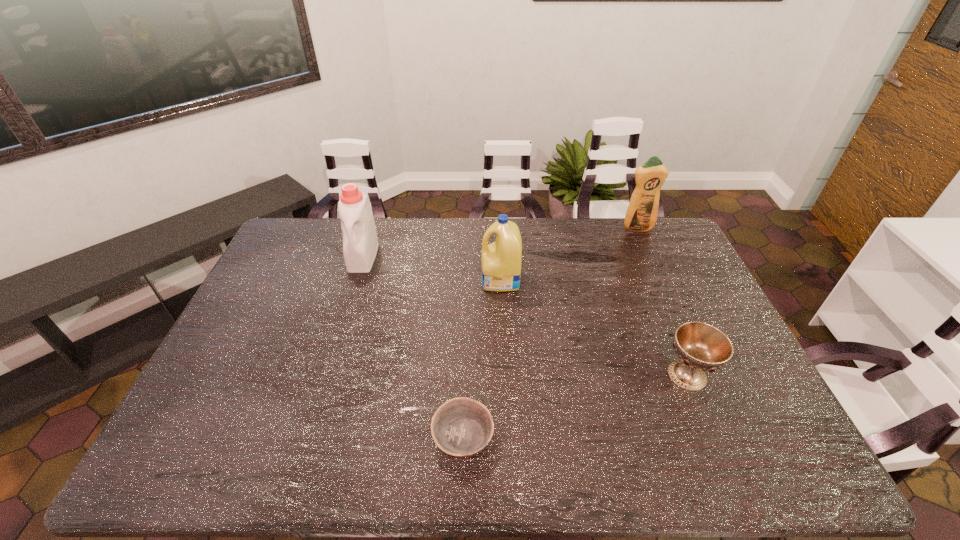
Find the location of a particular element. This screenshot has height=540, width=960. vacant space situated 0.070m on the label of the second detergent from right to left is located at coordinates (461, 280).

The height and width of the screenshot is (540, 960). I want to click on free space located on the label of the second detergent from right to left, so click(451, 280).

Image resolution: width=960 pixels, height=540 pixels. In order to click on vacant space situated 0.160m on the label of the second detergent from right to left in this screenshot , I will do click(x=434, y=280).

This screenshot has width=960, height=540. Identify the location of vacant area located on the right of the chalice. (734, 375).

This screenshot has height=540, width=960. In order to click on vacant space situated on the right of the shortest object in this screenshot , I will do `click(601, 436)`.

The height and width of the screenshot is (540, 960). I want to click on object that is at the near edge, so pyautogui.click(x=461, y=427).

Where is `detergent that is at the right edge`? This screenshot has height=540, width=960. detergent that is at the right edge is located at coordinates (641, 215).

This screenshot has height=540, width=960. Identify the location of chalice at the right edge. (701, 347).

Locate an element on the screen. Image resolution: width=960 pixels, height=540 pixels. object at the far right corner is located at coordinates (641, 215).

Identify the location of free location at the far edge of the desktop. Image resolution: width=960 pixels, height=540 pixels. (420, 233).